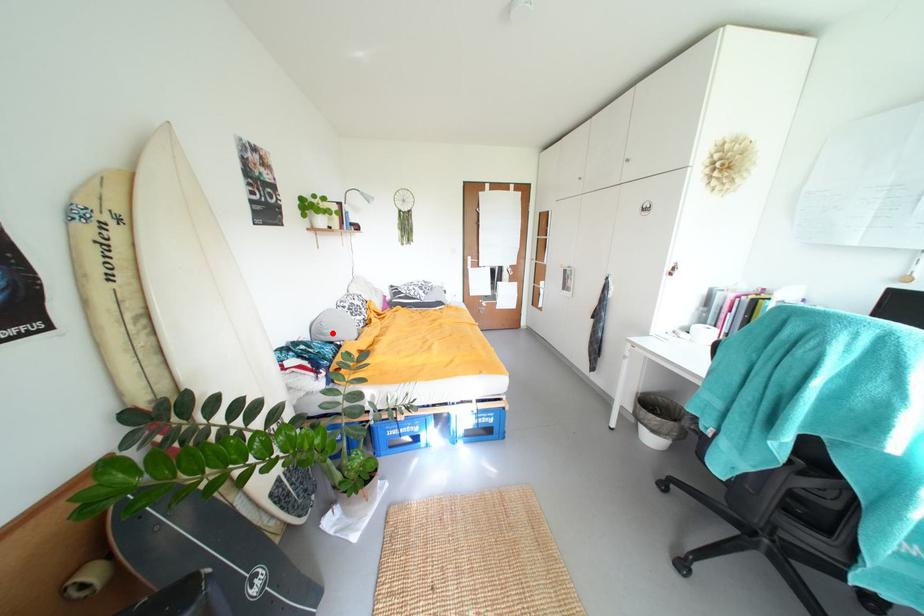
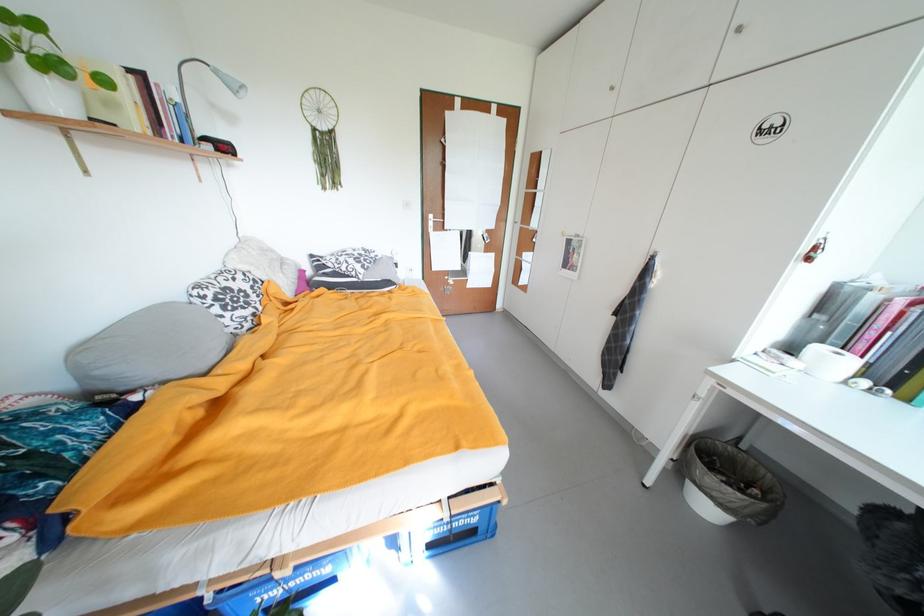
Question: A red point is marked in image1. In image2, is the corresponding 3D point closer to the camera or farther? Reply with the corresponding letter.

Choices:
 (A) The corresponding 3D point is closer.
 (B) The corresponding 3D point is farther.

Answer: (B)